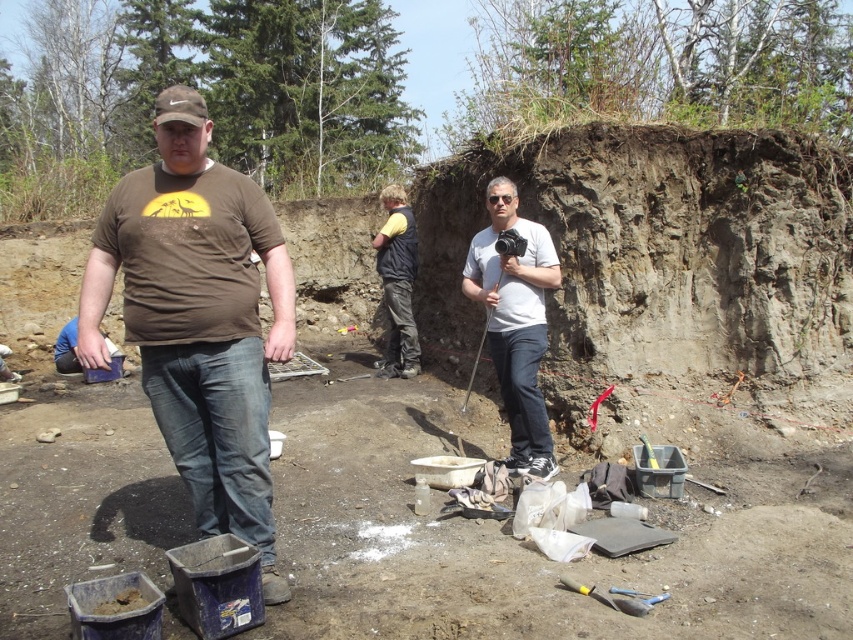
Question: Is brown cotton t-shirt at left to the left of white matte camera at center from the viewer's perspective?

Choices:
 (A) yes
 (B) no

Answer: (A)

Question: Which object is the closest to the yellow fabric vest at center?

Choices:
 (A) brown cotton t-shirt at left
 (B) white matte camera at center

Answer: (B)

Question: Among these points, which one is nearest to the camera?

Choices:
 (A) (524, 269)
 (B) (380, 228)

Answer: (A)

Question: Can you confirm if brown cotton t-shirt at left is bigger than yellow fabric vest at center?

Choices:
 (A) yes
 (B) no

Answer: (B)

Question: Based on their relative distances, which object is nearer to the brown cotton t-shirt at left?

Choices:
 (A) yellow fabric vest at center
 (B) white matte camera at center

Answer: (B)

Question: Can you confirm if brown cotton t-shirt at left is bigger than white matte camera at center?

Choices:
 (A) yes
 (B) no

Answer: (B)